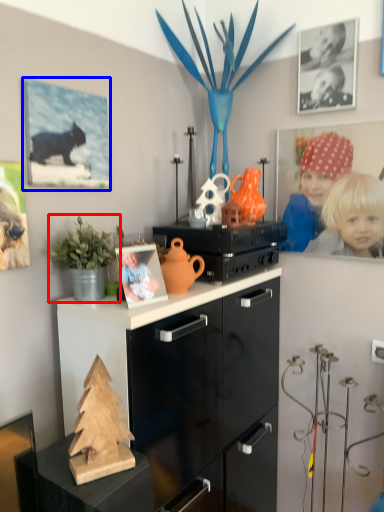
Question: Which point is closer to the camera, houseplant (highlighted by a red box) or picture frame (highlighted by a blue box)?

Choices:
 (A) houseplant
 (B) picture frame

Answer: (A)